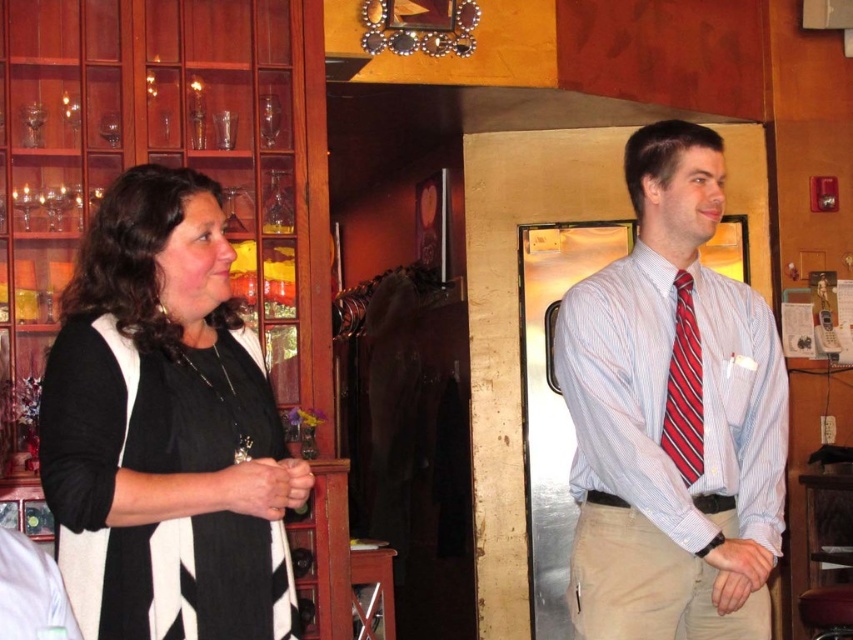
Question: Is striped cotton shirt at right below red striped tie at right?

Choices:
 (A) yes
 (B) no

Answer: (A)

Question: In this image, where is black matte sweater at left located relative to red striped tie at right?

Choices:
 (A) below
 (B) above

Answer: (A)

Question: Which object is positioned farthest from the red striped tie at right?

Choices:
 (A) black matte sweater at left
 (B) striped cotton shirt at right

Answer: (A)

Question: Among these points, which one is farthest from the camera?

Choices:
 (A) (96, 289)
 (B) (590, 417)
 (C) (698, 454)

Answer: (C)

Question: Considering the real-world distances, which object is farthest from the red striped tie at right?

Choices:
 (A) black matte sweater at left
 (B) striped cotton shirt at right

Answer: (A)

Question: Does black matte sweater at left have a larger size compared to striped cotton shirt at right?

Choices:
 (A) yes
 (B) no

Answer: (B)